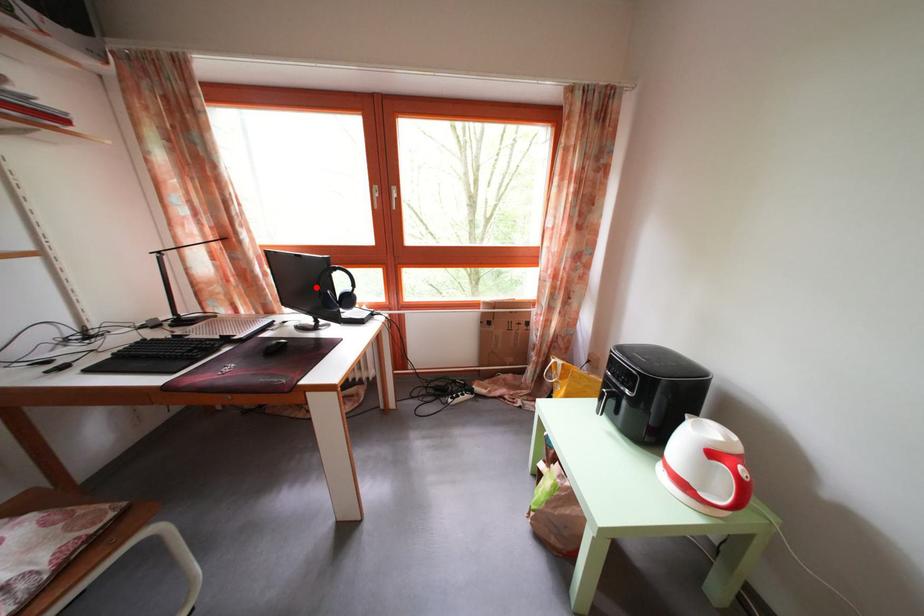
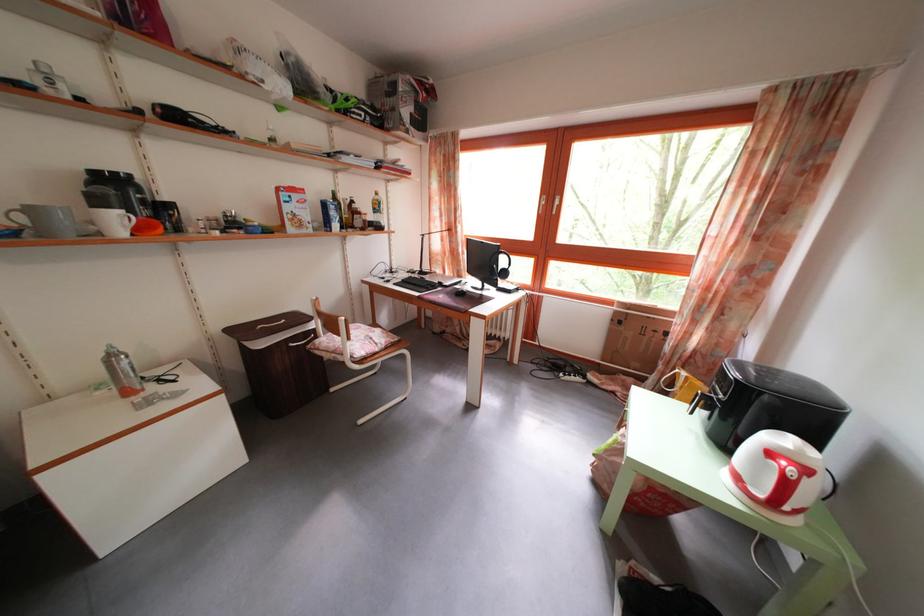
The point at the highlighted location is marked in the first image. Where is the corresponding point in the second image?

(492, 265)